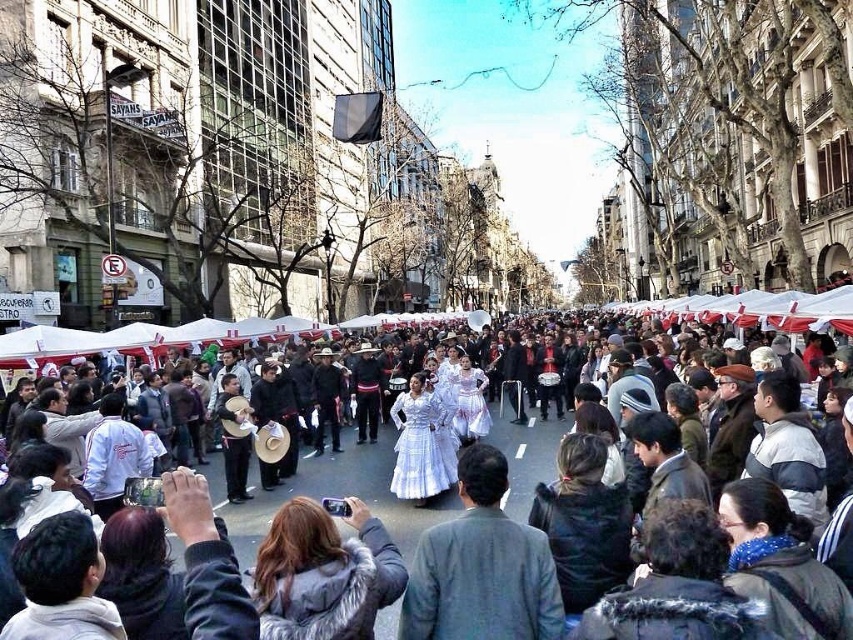
Can you confirm if white lace dress at center is positioned to the right of white cotton dress at center?

Incorrect, white lace dress at center is not on the right side of white cotton dress at center.

The height and width of the screenshot is (640, 853). What are the coordinates of `white lace dress at center` in the screenshot? It's located at (480, 566).